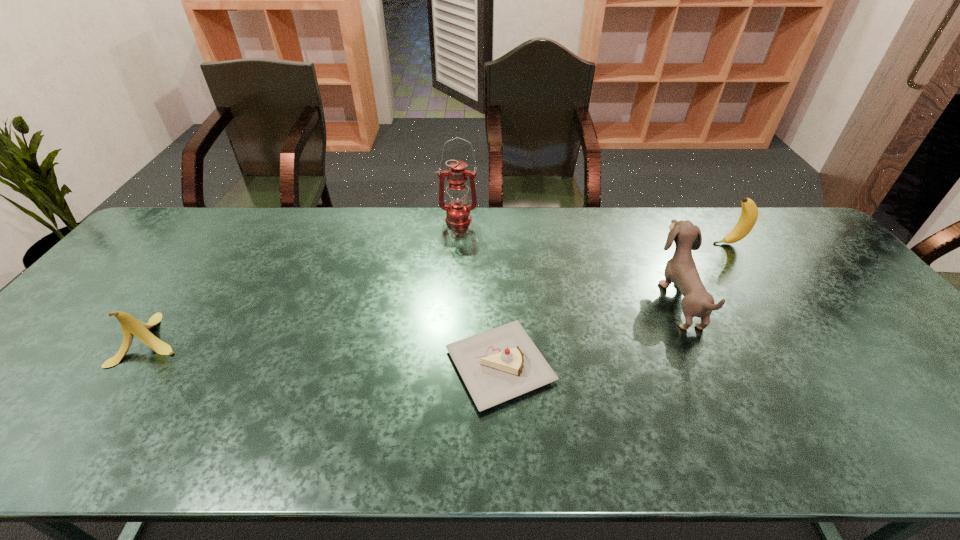
The image size is (960, 540). I want to click on vacant region located 0.350m at the face of the puppy, so click(x=537, y=300).

The height and width of the screenshot is (540, 960). I want to click on vacant space located 0.220m at the face of the puppy, so click(x=584, y=300).

The height and width of the screenshot is (540, 960). Identify the location of vacant space located from the stem of the farther banana. (698, 244).

Where is `vacant space located from the stem of the farther banana`? The height and width of the screenshot is (540, 960). vacant space located from the stem of the farther banana is located at coordinates (666, 244).

Locate an element on the screen. free space located 0.110m from the stem of the farther banana is located at coordinates (679, 244).

I want to click on free space located on the back of the left banana, so click(x=212, y=256).

You are a GUI agent. You are given a task and a screenshot of the screen. Output one action in this format:
    pyautogui.click(x=<x>, y=<y>)
    Task: Click on the vacant region located on the right of the shortest object
    Image resolution: width=960 pixels, height=540 pixels.
    Given the screenshot: What is the action you would take?
    pyautogui.click(x=642, y=366)

You are a GUI agent. You are given a task and a screenshot of the screen. Output one action in this format:
    pyautogui.click(x=<x>, y=<y>)
    Task: Click on the oil lamp located in the far edge section of the desktop
    Image resolution: width=960 pixels, height=540 pixels.
    Given the screenshot: What is the action you would take?
    pyautogui.click(x=458, y=213)

The width and height of the screenshot is (960, 540). In order to click on banana that is at the far edge in this screenshot , I will do `click(749, 214)`.

The height and width of the screenshot is (540, 960). Find the location of `vacant space at the far edge of the desktop`. vacant space at the far edge of the desktop is located at coordinates (275, 245).